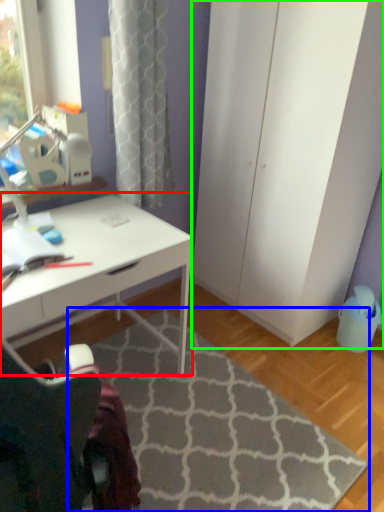
Question: Considering the real-world distances, which object is farthest from desk (highlighted by a red box)? doormat (highlighted by a blue box) or screen door (highlighted by a green box)?

Choices:
 (A) doormat
 (B) screen door

Answer: (B)